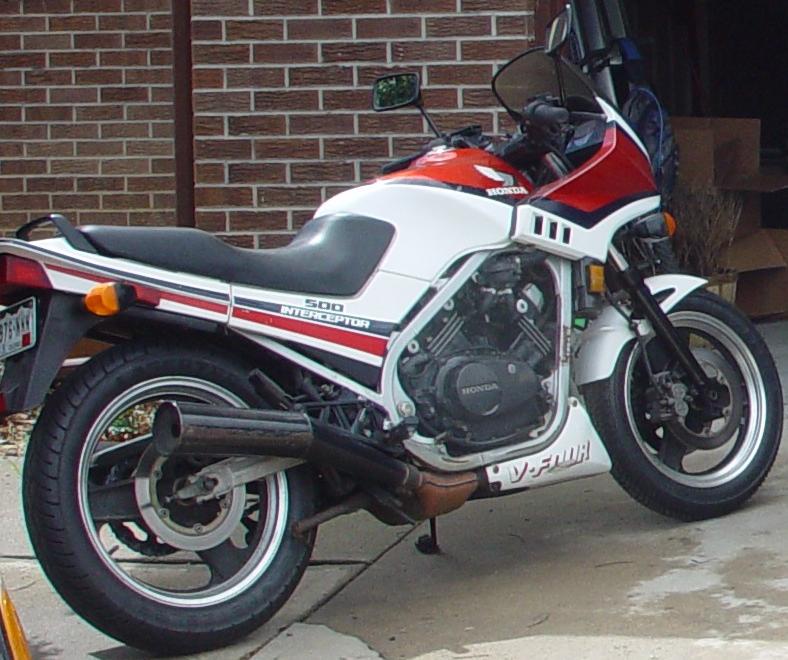
Locate an element on the screen. brick wall is located at coordinates (326, 69).